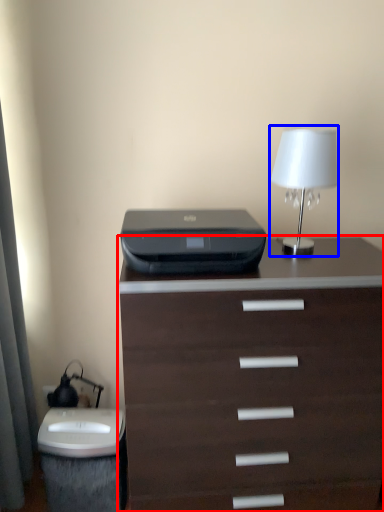
Question: Which point is further to the camera, chest of drawers (highlighted by a red box) or bedside lamp (highlighted by a blue box)?

Choices:
 (A) chest of drawers
 (B) bedside lamp

Answer: (B)